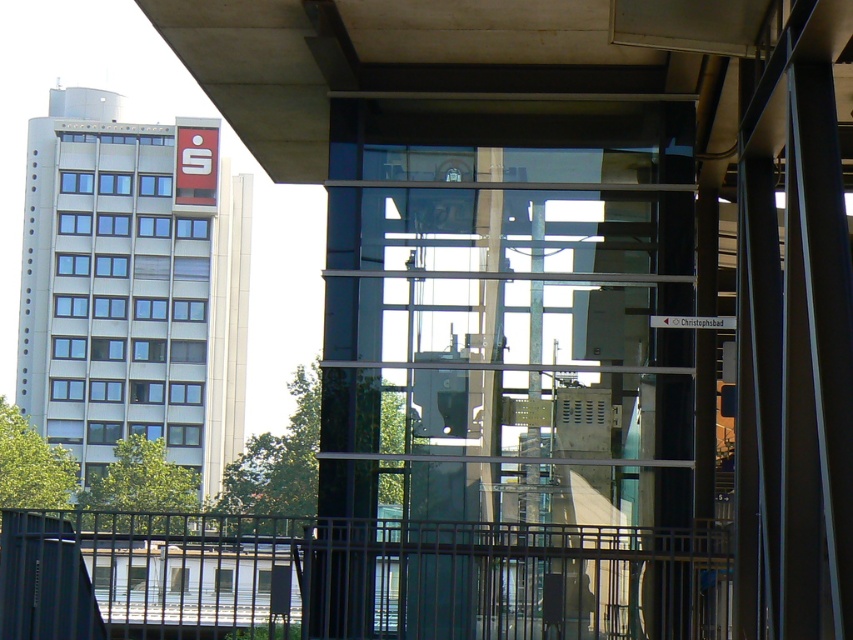
You are a construction worker standing on the metallic gray rail at lower center. You need to reach the concrete ceiling at upper center to install a safety harness. The harness requires a minimum distance of 30 meters between the anchor point and your current position. Can you safely use this location for the harness?

The concrete ceiling at upper center is 34.89 meters from the metallic gray rail at lower center. Since the required minimum distance is 30 meters, the current location meets the safety requirement, so you can safely use this location for the harness.

You are standing at the entrance of the building and see the transparent glass elevator at center and the metallic gray rail at lower center. Which object is positioned to the right side?

The transparent glass elevator at center is positioned to the right of the metallic gray rail at lower center.